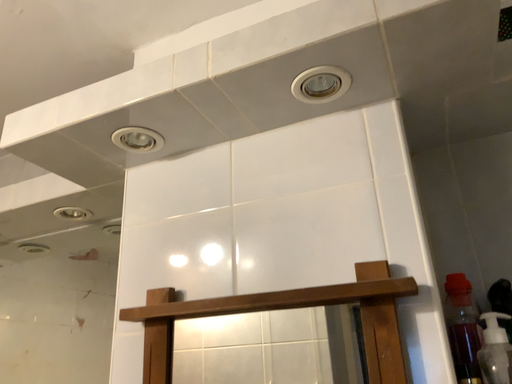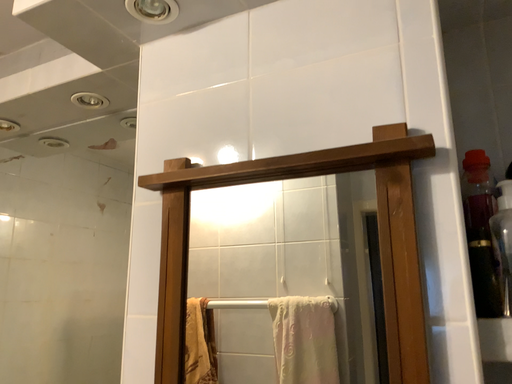
Question: How did the camera likely rotate when shooting the video?

Choices:
 (A) rotated downward
 (B) rotated upward

Answer: (A)